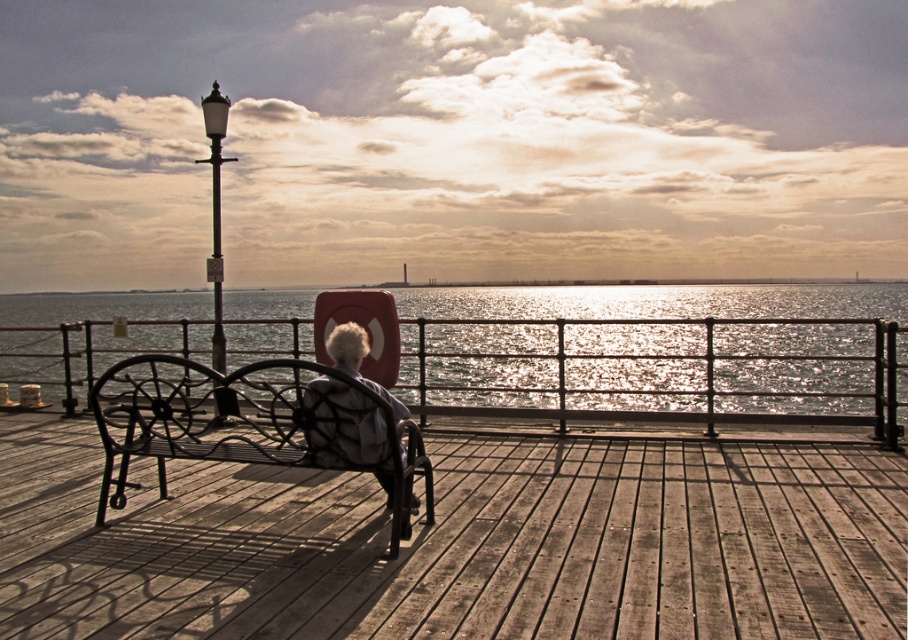
Question: Is the position of wooden at center less distant than that of black wrought iron bench at center?

Choices:
 (A) no
 (B) yes

Answer: (B)

Question: Observing the image, what is the correct spatial positioning of wooden at center in reference to white textured hair at center?

Choices:
 (A) left
 (B) right

Answer: (B)

Question: Which point appears farthest from the camera in this image?

Choices:
 (A) (87, 586)
 (B) (344, 326)
 (C) (94, 333)

Answer: (C)

Question: Which object is the closest to the white textured hair at center?

Choices:
 (A) shiny metallic water at center
 (B) black wrought iron bench at center

Answer: (B)

Question: Among these points, which one is nearest to the camera?

Choices:
 (A) (358, 364)
 (B) (232, 445)
 (C) (317, 506)
 (D) (435, 323)

Answer: (A)

Question: Can you confirm if wooden at center is thinner than shiny metallic water at center?

Choices:
 (A) no
 (B) yes

Answer: (B)